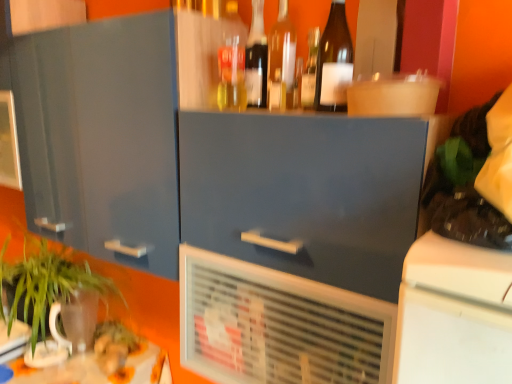
Question: Relative to translucent glass bottle at center, marked as the fourth bottle in a left-to-right arrangement, is brown glass bottle at upper center, marked as the fifth bottle in a left-to-right arrangement, in front or behind?

Choices:
 (A) behind
 (B) front

Answer: (B)

Question: Considering the positions of brown glass bottle at upper center, marked as the fifth bottle in a left-to-right arrangement, and translucent glass bottle at center, marked as the fourth bottle in a left-to-right arrangement, in the image, is brown glass bottle at upper center, marked as the fifth bottle in a left-to-right arrangement, bigger or smaller than translucent glass bottle at center, marked as the fourth bottle in a left-to-right arrangement,?

Choices:
 (A) big
 (B) small

Answer: (A)

Question: Estimate the real-world distances between objects in this image. Which object is farther from the brown glass bottle at upper center, marked as the fifth bottle in a left-to-right arrangement?

Choices:
 (A) translucent glass bottle at upper center, which ranks as the second bottle in left-to-right order
 (B) translucent plastic bottle at upper center, the 1th bottle positioned from the left
 (C) green leafy plant at lower left
 (D) matte gray cabinet at center, the 1th cabinetry in the right-to-left sequence
 (E) transparent glass bottle at upper center, which is counted as the 3th bottle, starting from the right

Answer: (C)

Question: Which is farther from the brown glass bottle at upper center, the 1th bottle in the right-to-left sequence?

Choices:
 (A) translucent glass bottle at center, marked as the fourth bottle in a left-to-right arrangement
 (B) translucent glass bottle at upper center, the 4th bottle viewed from the right
 (C) transparent glass bottle at upper center, marked as the third bottle in a left-to-right arrangement
 (D) translucent plastic bottle at upper center, the 1th bottle positioned from the left
 (E) white plastic air conditioning unit at center

Answer: (E)